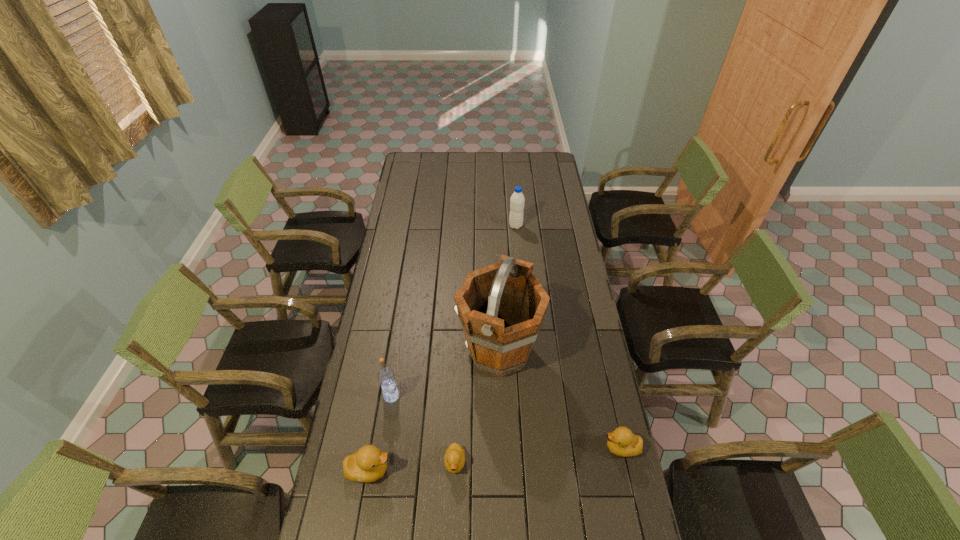
At what (x,y) coordinates should I click in order to perform the action: click on free spot located 0.170m facing forward on the tallest duckling. Please return your answer as a coordinate pair (x, y). The width and height of the screenshot is (960, 540). Looking at the image, I should click on (446, 470).

Image resolution: width=960 pixels, height=540 pixels. I want to click on vacant region located facing forward on the second duckling from left to right, so click(453, 517).

At what (x,y) coordinates should I click in order to perform the action: click on free region located 0.350m facing forward on the fifth tallest object. Please return your answer as a coordinate pair (x, y). This screenshot has width=960, height=540. Looking at the image, I should click on (496, 448).

In order to click on vacant area situated 0.210m facing forward on the fifth tallest object in this screenshot , I will do `click(539, 448)`.

What are the coordinates of `blank area located 0.340m facing forward on the fifth tallest object` in the screenshot? It's located at (499, 448).

Identify the location of blank area located 0.180m on the front of the water bottle. This screenshot has height=540, width=960. coord(518,255).

You are a GUI agent. You are given a task and a screenshot of the screen. Output one action in this format:
    pyautogui.click(x=<x>, y=<y>)
    Task: Click on the vacant area located on the right of the fourth nearest object
    
    Given the screenshot: What is the action you would take?
    pyautogui.click(x=427, y=396)

Where is `free space located 0.100m on the right of the second farthest object`? The image size is (960, 540). free space located 0.100m on the right of the second farthest object is located at coordinates (567, 351).

This screenshot has width=960, height=540. Identify the location of duckling located at the left edge. (367, 464).

The height and width of the screenshot is (540, 960). I want to click on vodka that is at the left edge, so click(386, 377).